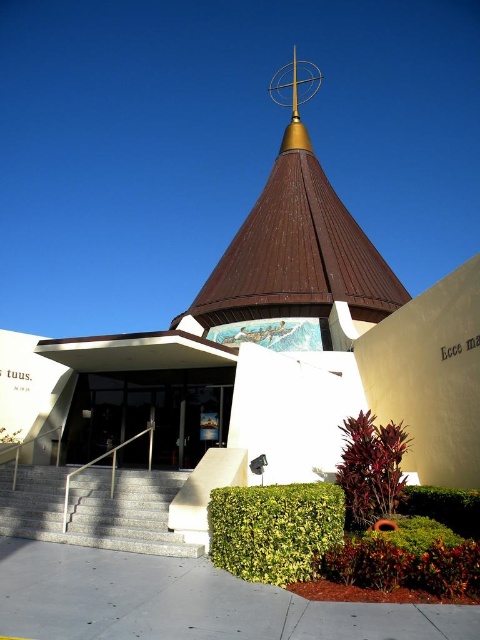
Question: In this image, where is granite stairs at lower left located relative to dark red leafy plant at lower center?

Choices:
 (A) above
 (B) below

Answer: (B)

Question: Which object is closer to the camera taking this photo?

Choices:
 (A) green leafy hedge at lower right
 (B) granite stairs at lower left

Answer: (B)

Question: Is granite stairs at lower left to the left of green leafy hedge at lower right from the viewer's perspective?

Choices:
 (A) yes
 (B) no

Answer: (A)

Question: Considering the relative positions of green leafy hedge at lower center and dark red leafy plant at lower center in the image provided, where is green leafy hedge at lower center located with respect to dark red leafy plant at lower center?

Choices:
 (A) above
 (B) below

Answer: (B)

Question: Which point is closer to the camera taking this photo?

Choices:
 (A) (360, 305)
 (B) (120, 547)

Answer: (B)

Question: Which object is the farthest from the brown metallic spire at center?

Choices:
 (A) green leafy hedge at lower center
 (B) green leafy hedge at lower right
 (C) dark red leafy plant at lower center
 (D) granite stairs at lower left

Answer: (B)